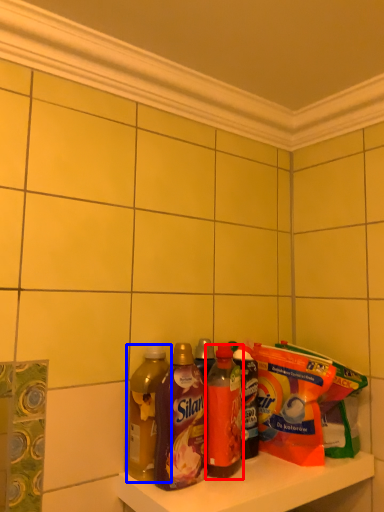
Question: Which of the following is the farthest to the observer, bottle (highlighted by a red box) or bottle (highlighted by a blue box)?

Choices:
 (A) bottle
 (B) bottle

Answer: (A)